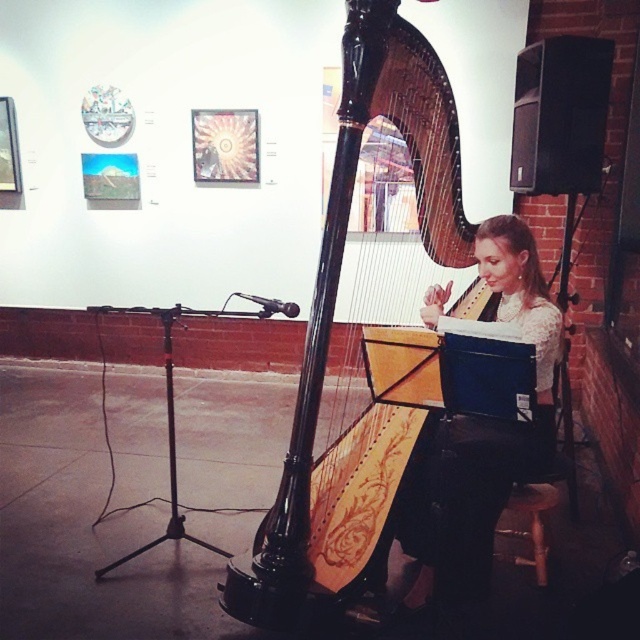
You are a photographer trying to capture a clear shot of the matte black harpist at center and the black polished wood harp at center. Which object should you focus on first if you want to ensure both are in focus without moving the camera?

You should focus on the matte black harpist at center first because it is behind the black polished wood harp at center, so focusing on the farther object first can help ensure both are in focus when using depth of field.

You are a photographer setting up for a session with the musician. You need to position a light source behind the black polished wood harp at center so it doesn not cast a shadow on the wooden stool at lower right. Based on the scene description, where should you place the light source?

The wooden stool at lower right is behind the black polished wood harp at center. To avoid casting a shadow on the stool, the light source should be placed in front of the harp, facing towards the musician and the stool.

Based on the photo, you are a photographer setting up a shot of the musician and her harp. You need to ensure both the matte black harpist at center and the wooden stool at lower right are fully visible in the frame. Given that the camera has a fixed width, which object should you position closer to the camera to avoid cropping either?

Since the matte black harpist at center is wider than the wooden stool at lower right, you should position the wooden stool at lower right closer to the camera to ensure both fit within the frame without cropping.